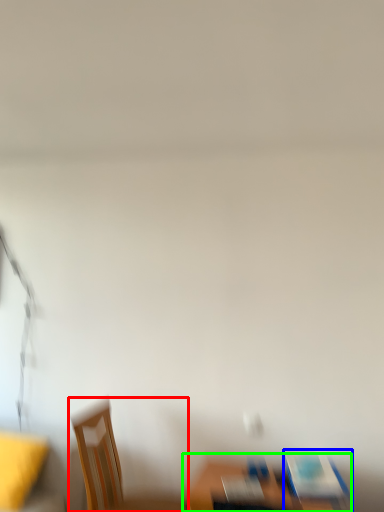
Question: Estimate the real-world distances between objects in this image. Which object is farther from chair (highlighted by a red box), chair (highlighted by a blue box) or furniture (highlighted by a green box)?

Choices:
 (A) chair
 (B) furniture

Answer: (A)